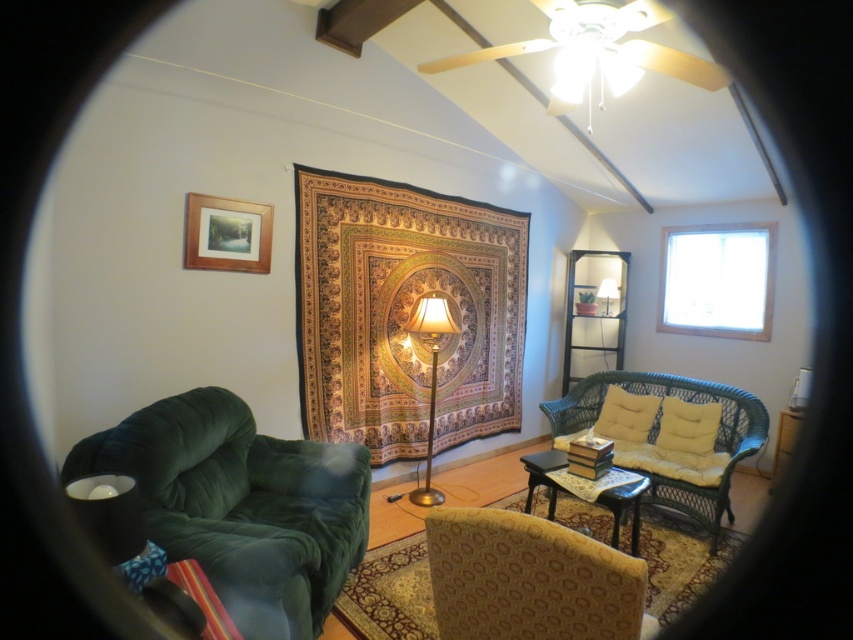
Question: Can you confirm if multicolored woven tapestry at center is positioned to the left of gold metallic floor lamp at center?

Choices:
 (A) yes
 (B) no

Answer: (B)

Question: Among these points, which one is farthest from the camera?

Choices:
 (A) (706, 408)
 (B) (630, 540)
 (C) (511, 561)

Answer: (A)

Question: Which point is farther to the camera?

Choices:
 (A) wooden table at center
 (B) gold metallic floor lamp at center

Answer: (B)

Question: Which of the following is the farthest from the observer?

Choices:
 (A) (248, 204)
 (B) (503, 605)
 (C) (607, 280)
 (D) (511, 273)

Answer: (C)

Question: Can you confirm if multicolored woven tapestry at center is smaller than patterned fabric armchair at center?

Choices:
 (A) no
 (B) yes

Answer: (A)

Question: Does patterned fabric armchair at center have a greater width compared to green wicker couch at center?

Choices:
 (A) no
 (B) yes

Answer: (A)